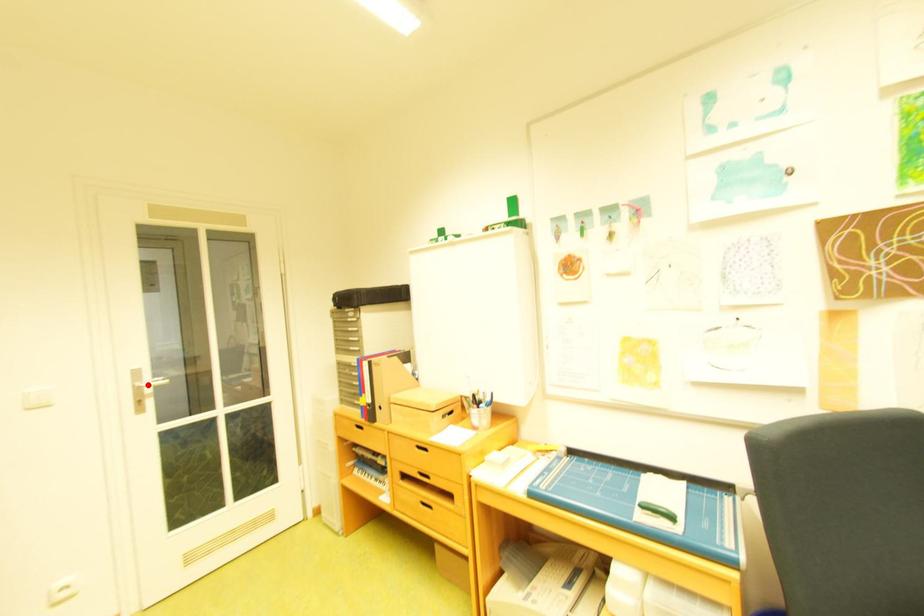
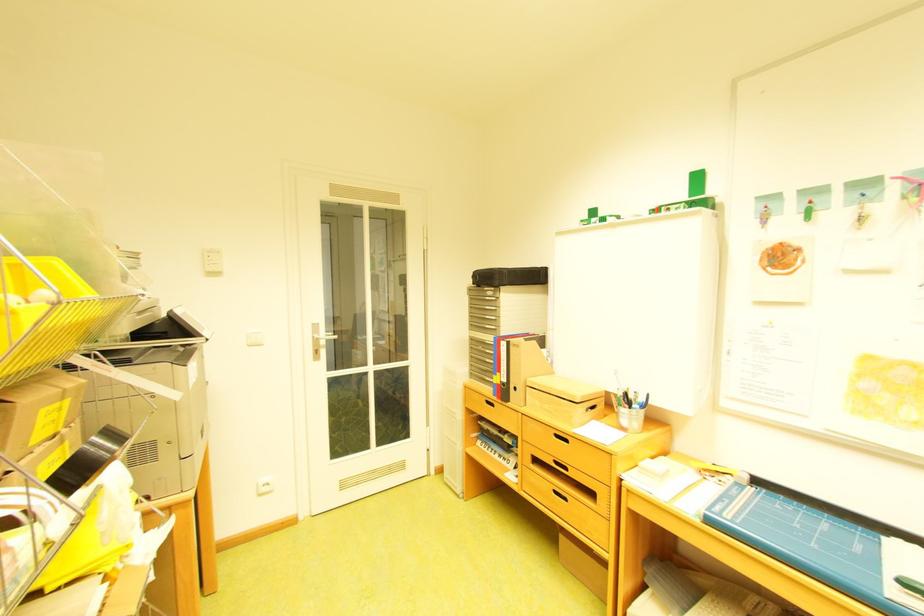
The point at the highlighted location is marked in the first image. Where is the corresponding point in the second image?

(327, 337)